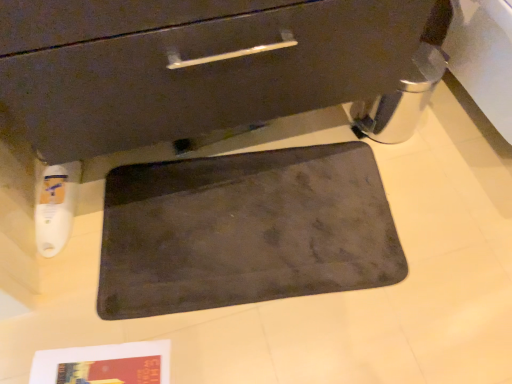
The width and height of the screenshot is (512, 384). Describe the element at coordinates (191, 65) in the screenshot. I see `matte black drawer at center` at that location.

This screenshot has width=512, height=384. I want to click on matte black drawer at center, so click(x=191, y=65).

Measure the distance between point (305, 155) and camera.

The distance of point (305, 155) from camera is 1.21 meters.

Describe the element at coordinates (245, 230) in the screenshot. This screenshot has width=512, height=384. I see `dark gray matte bath mat at center` at that location.

What are the coordinates of `dark gray matte bath mat at center` in the screenshot? It's located at (245, 230).

What is the approximate height of dark gray matte bath mat at center?

The height of dark gray matte bath mat at center is 0.77 inches.

You are a GUI agent. You are given a task and a screenshot of the screen. Output one action in this format:
    pyautogui.click(x=<x>, y=<y>)
    Task: Click on the matte black drawer at center
    This screenshot has height=384, width=512.
    Given the screenshot: What is the action you would take?
    pyautogui.click(x=191, y=65)

Which object is positioned more to the left, dark gray matte bath mat at center or matte black drawer at center?

matte black drawer at center.

Is dark gray matte bath mat at center further to camera compared to matte black drawer at center?

Yes, it is behind matte black drawer at center.

Which is closer to the camera, (370, 223) or (211, 31)?

Point (370, 223) is positioned farther from the camera compared to point (211, 31).

From the image's perspective, is dark gray matte bath mat at center on matte black drawer at center?

No, from the image's perspective, dark gray matte bath mat at center is not on top of matte black drawer at center.

In the scene shown: From a real-world perspective, is dark gray matte bath mat at center positioned above or below matte black drawer at center?

Clearly, from a real-world perspective, dark gray matte bath mat at center is below matte black drawer at center.

Considering the sizes of objects dark gray matte bath mat at center and matte black drawer at center in the image provided, who is wider, dark gray matte bath mat at center or matte black drawer at center?

With larger width is matte black drawer at center.

Is dark gray matte bath mat at center shorter than matte black drawer at center?

Yes, dark gray matte bath mat at center is shorter than matte black drawer at center.

Which of these two, dark gray matte bath mat at center or matte black drawer at center, is smaller?

With smaller size is dark gray matte bath mat at center.

Would you say dark gray matte bath mat at center contains matte black drawer at center?

Definitely not — matte black drawer at center is not inside dark gray matte bath mat at center.

Are dark gray matte bath mat at center and matte black drawer at center located far from each other?

No, dark gray matte bath mat at center is in close proximity to matte black drawer at center.

Is dark gray matte bath mat at center oriented towards matte black drawer at center?

No, dark gray matte bath mat at center does not turn towards matte black drawer at center.

This screenshot has width=512, height=384. Identify the location of bath mat that is below the matte black drawer at center (from the image's perspective). (245, 230).

Considering the positions of objects matte black drawer at center and dark gray matte bath mat at center in the image provided, who is more to the left, matte black drawer at center or dark gray matte bath mat at center?

From the viewer's perspective, matte black drawer at center appears more on the left side.

Considering their positions, is matte black drawer at center located in front of or behind dark gray matte bath mat at center?

matte black drawer at center is positioned closer to the viewer than dark gray matte bath mat at center.

Between point (150, 88) and point (163, 164), which one is positioned behind?

The point (163, 164) is more distant.

From the image's perspective, is matte black drawer at center located above dark gray matte bath mat at center?

Correct, matte black drawer at center appears higher than dark gray matte bath mat at center in the image.

From a real-world perspective, relative to dark gray matte bath mat at center, is matte black drawer at center vertically above or below?

matte black drawer at center is situated higher than dark gray matte bath mat at center in the real world.

Which of these two, matte black drawer at center or dark gray matte bath mat at center, is wider?

With larger width is matte black drawer at center.

Looking at this image, who is shorter, matte black drawer at center or dark gray matte bath mat at center?

dark gray matte bath mat at center.

Which of these two, matte black drawer at center or dark gray matte bath mat at center, is smaller?

With smaller size is dark gray matte bath mat at center.

Is matte black drawer at center situated inside dark gray matte bath mat at center or outside?

matte black drawer at center is not inside dark gray matte bath mat at center, it's outside.

Is the surface of matte black drawer at center in direct contact with dark gray matte bath mat at center?

No, matte black drawer at center is not with dark gray matte bath mat at center.

Is matte black drawer at center oriented towards dark gray matte bath mat at center?

No, matte black drawer at center is not facing towards dark gray matte bath mat at center.

How many degrees apart are the facing directions of matte black drawer at center and dark gray matte bath mat at center?

They differ by 9.25 degrees in their facing directions.

What are the coordinates of `bath mat located behind the matte black drawer at center` in the screenshot? It's located at (245, 230).

Locate an element on the screen. drawer located above the dark gray matte bath mat at center (from a real-world perspective) is located at coordinates (191, 65).

In the image, there is a matte black drawer at center. In order to click on bath mat below it (from the image's perspective) in this screenshot , I will do `click(245, 230)`.